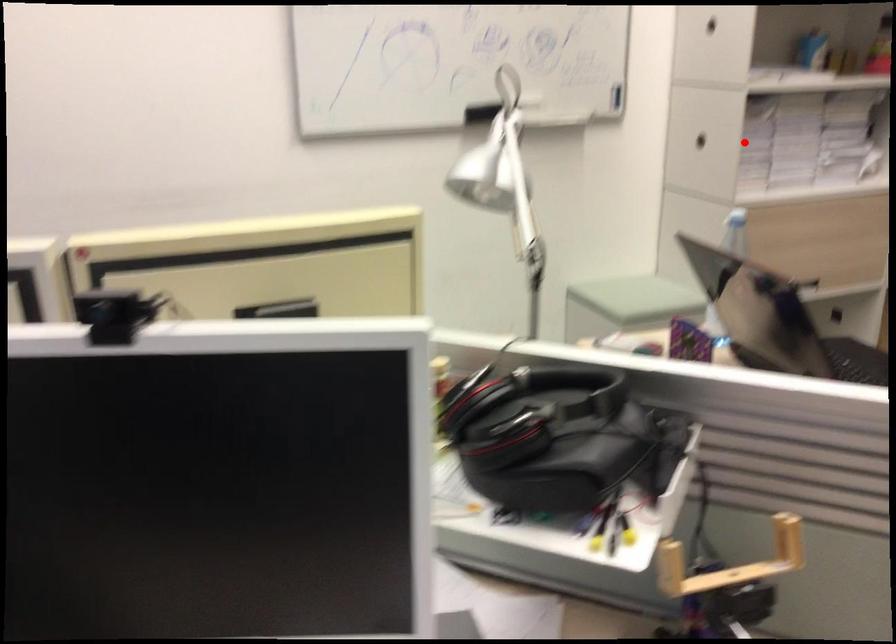
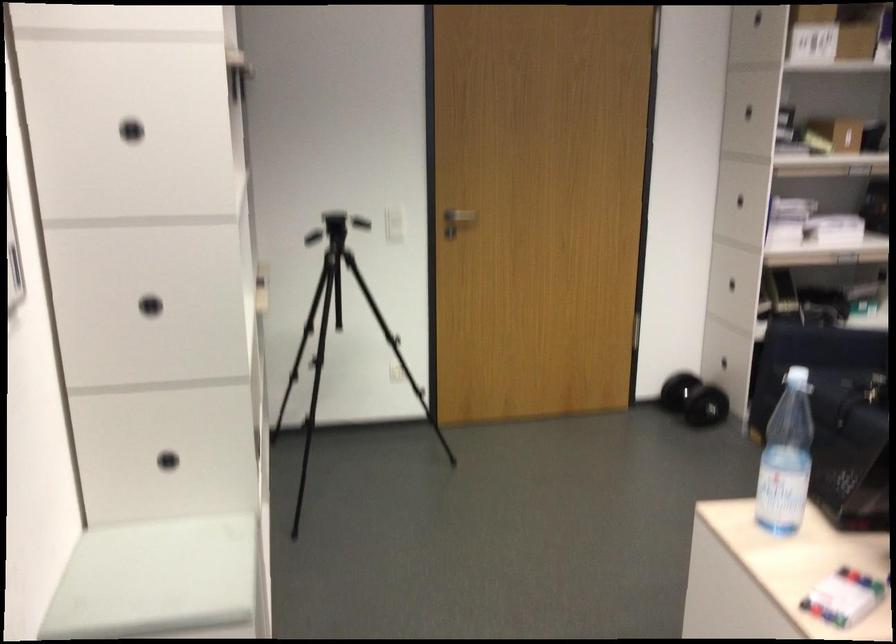
Question: I am providing you with two images of the same scene from different viewpoints. A red point is shown in image1. For the corresponding object point in image2, is it positioned nearer or farther from the camera?

Choices:
 (A) Nearer
 (B) Farther

Answer: (A)